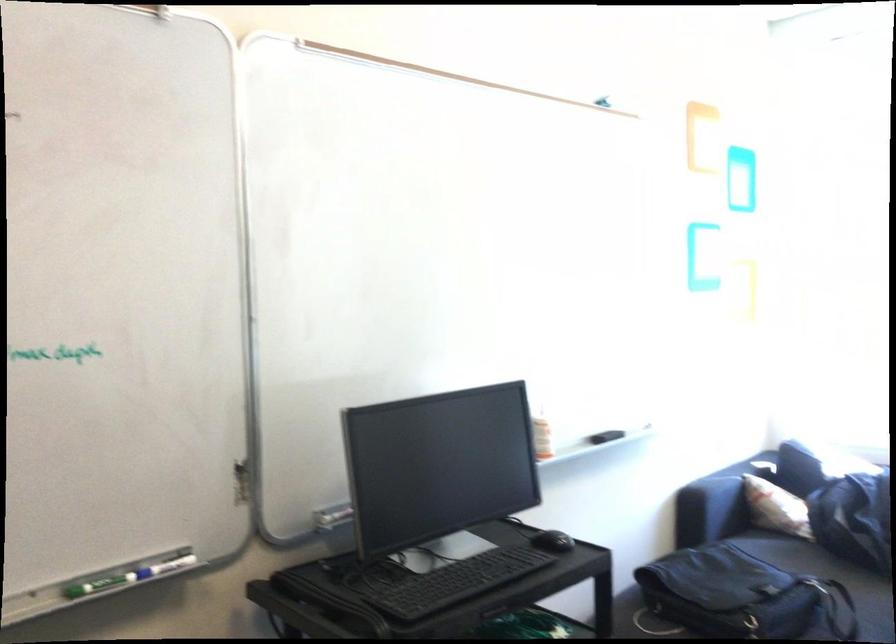
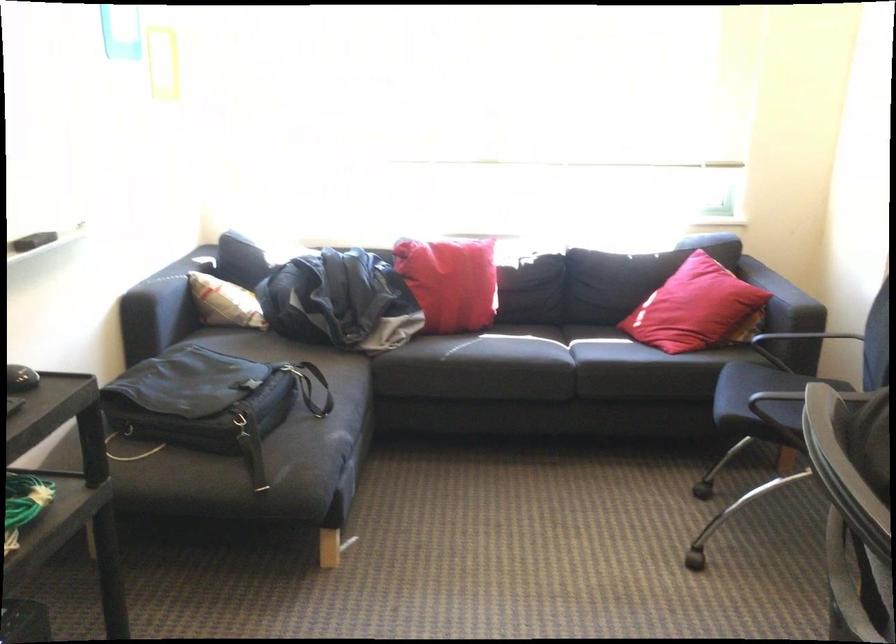
Question: Based on the continuous images, in which direction is the camera rotating? Reply with the corresponding letter.

Choices:
 (A) Left
 (B) Right
 (C) Up
 (D) Down

Answer: (B)